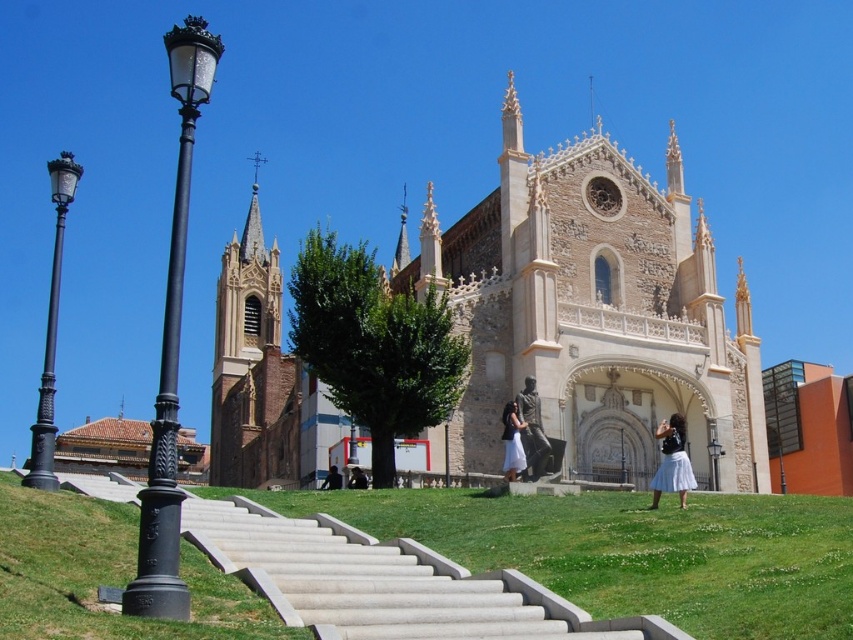
Is beige stone church at center in front of smooth concrete stairs at center?

No, it is behind smooth concrete stairs at center.

Who is positioned more to the left, beige stone church at center or smooth concrete stairs at center?

smooth concrete stairs at center is more to the left.

Between point (556, 304) and point (384, 572), which one is positioned in front?

Point (384, 572) is in front.

At what (x,y) coordinates should I click in order to perform the action: click on beige stone church at center. Please return your answer as a coordinate pair (x, y). This screenshot has width=853, height=640. Looking at the image, I should click on (590, 316).

Is white cotton skirt at lower right below dark fabric bag at lower center?

No, white cotton skirt at lower right is not below dark fabric bag at lower center.

Can you confirm if white cotton skirt at lower right is wider than dark fabric bag at lower center?

Indeed, white cotton skirt at lower right has a greater width compared to dark fabric bag at lower center.

Does point (694, 486) lie in front of point (329, 481)?

Yes, point (694, 486) is closer to viewer.

I want to click on white cotton skirt at lower right, so click(672, 461).

Can you confirm if dark fabric bag at lower center is shorter than dark brown leather jacket at center?

Indeed, dark fabric bag at lower center has a lesser height compared to dark brown leather jacket at center.

Consider the image. Can you confirm if dark fabric bag at lower center is thinner than dark brown leather jacket at center?

Correct, dark fabric bag at lower center's width is less than dark brown leather jacket at center's.

The image size is (853, 640). What do you see at coordinates (332, 477) in the screenshot? I see `dark fabric bag at lower center` at bounding box center [332, 477].

I want to click on dark fabric bag at lower center, so click(332, 477).